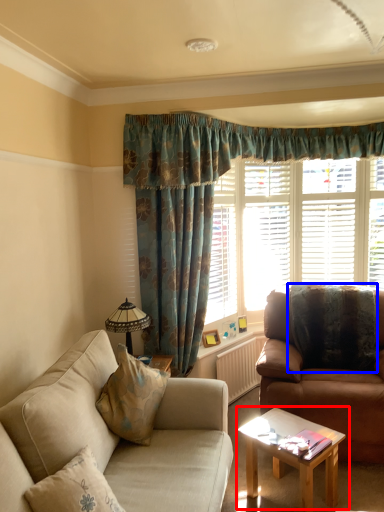
Question: Which object is further to the camera taking this photo, coffee table (highlighted by a red box) or pillow (highlighted by a blue box)?

Choices:
 (A) coffee table
 (B) pillow

Answer: (B)